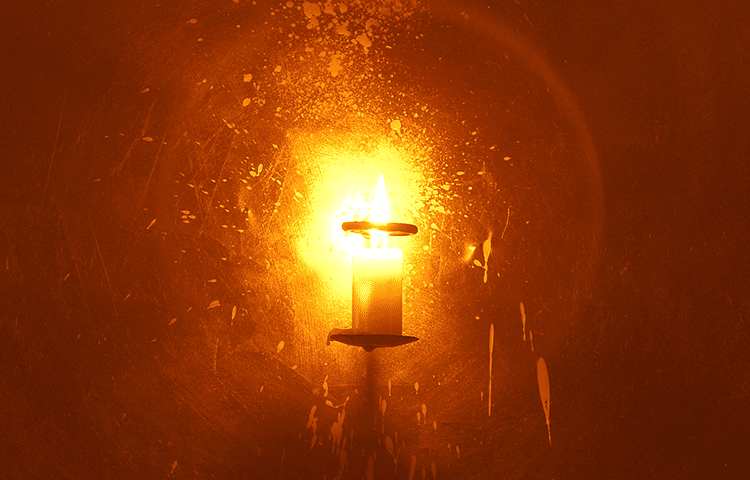
Where is `candle`? candle is located at coordinates (394, 308).